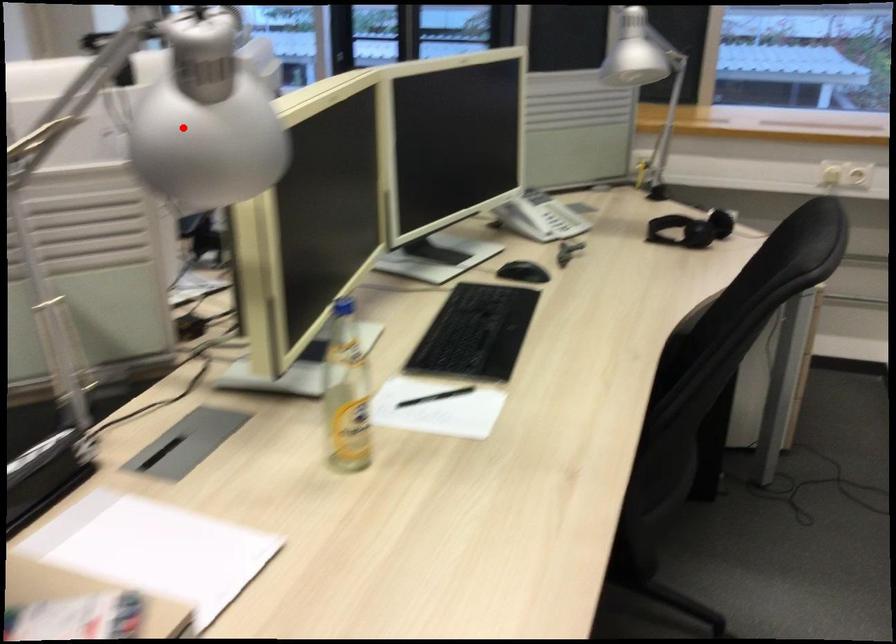
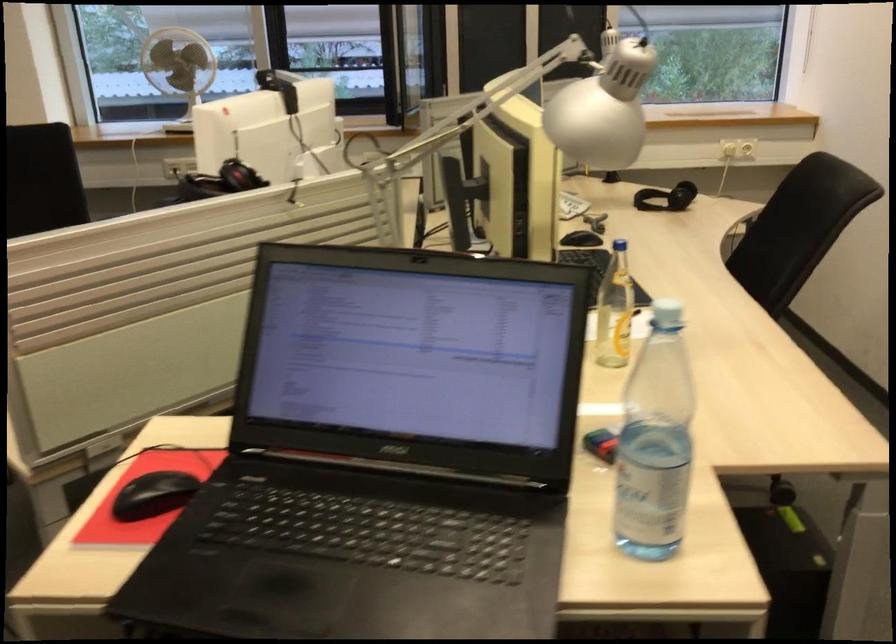
Question: A red point is marked in image1. In image2, is the corresponding 3D point closer to the camera or farther? Reply with the corresponding letter.

Choices:
 (A) The corresponding 3D point is closer.
 (B) The corresponding 3D point is farther.

Answer: (B)